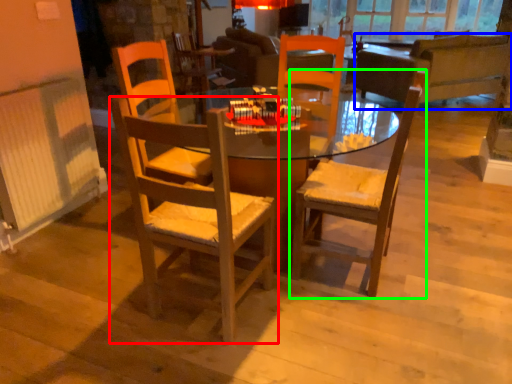
Question: Based on their relative distances, which object is nearer to chair (highlighted by a red box)? Choose from studio couch (highlighted by a blue box) and chair (highlighted by a green box).

Choices:
 (A) studio couch
 (B) chair

Answer: (B)